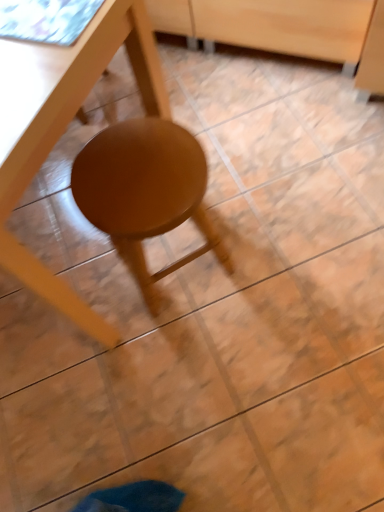
Where is `free space in front of matte wood stool at center`? Image resolution: width=384 pixels, height=512 pixels. free space in front of matte wood stool at center is located at coordinates (195, 385).